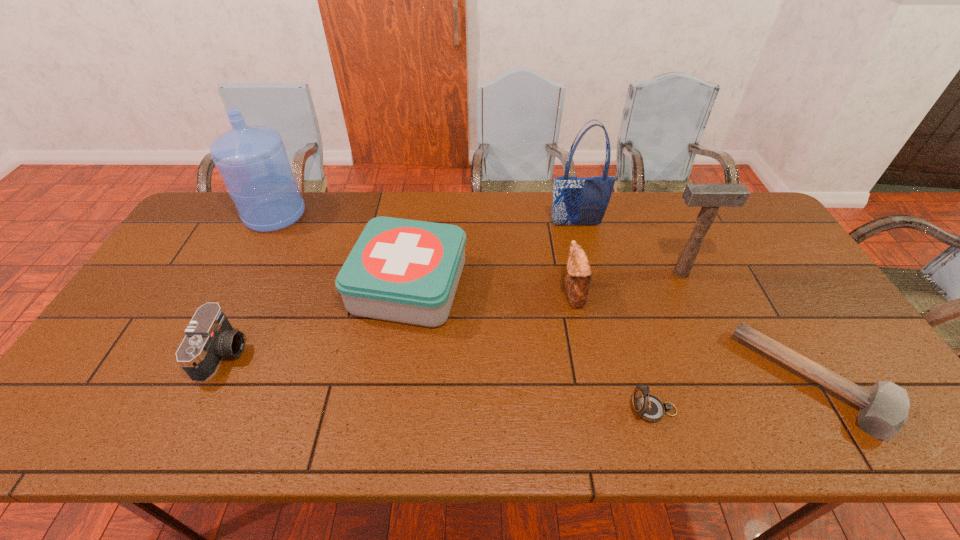
At what (x,y) coordinates should I click in order to perform the action: click on vacant space at the far edge of the desktop. Please return your answer as a coordinate pair (x, y). This screenshot has height=540, width=960. Looking at the image, I should click on (332, 195).

This screenshot has height=540, width=960. I want to click on vacant region at the near edge of the desktop, so click(513, 414).

Locate an element on the screen. vacant area at the left edge of the desktop is located at coordinates point(146,329).

The height and width of the screenshot is (540, 960). What are the coordinates of `free space at the right edge of the desktop` in the screenshot? It's located at (743, 254).

Locate an element on the screen. vacant region at the far left corner of the desktop is located at coordinates (204, 217).

Where is `blank space at the near left corner of the desktop`? The image size is (960, 540). blank space at the near left corner of the desktop is located at coordinates (68, 430).

Where is `free area in between the taller mallet and the clutch bag`? The width and height of the screenshot is (960, 540). free area in between the taller mallet and the clutch bag is located at coordinates (627, 284).

You are a GUI agent. You are given a task and a screenshot of the screen. Output one action in this format:
    pyautogui.click(x=<x>, y=<y>)
    Task: Click on the free spot between the shopping bag and the water jug
    The image size is (960, 540).
    Given the screenshot: What is the action you would take?
    coord(425,220)

Locate an element on the screen. vacant space in between the fifth tallest object and the water jug is located at coordinates (342, 250).

This screenshot has height=540, width=960. I want to click on empty space between the shopping bag and the shortest object, so click(695, 303).